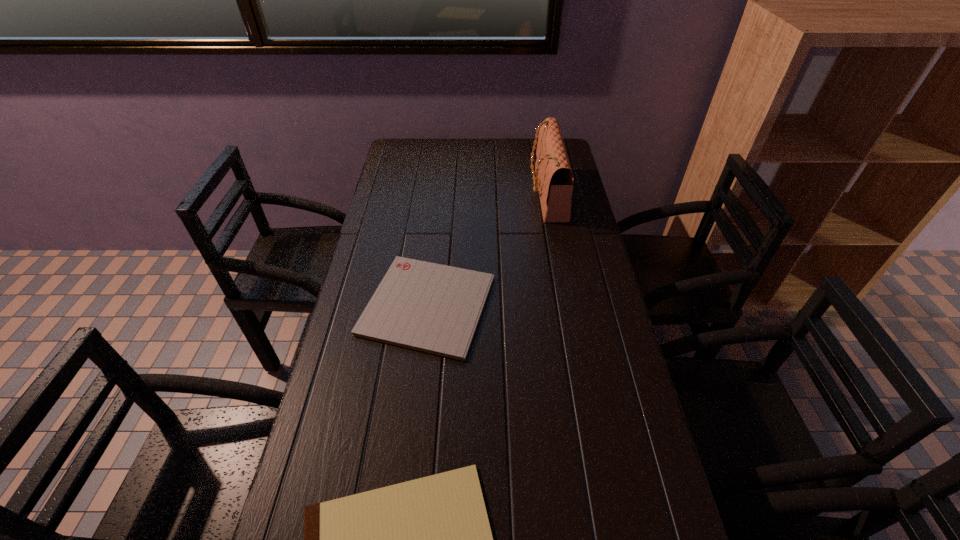
Where is `the farthest object`? Image resolution: width=960 pixels, height=540 pixels. the farthest object is located at coordinates (554, 179).

This screenshot has height=540, width=960. I want to click on handbag, so click(x=554, y=179).

Identify the location of the second shortest object. The height and width of the screenshot is (540, 960). (433, 308).

At what (x,y) coordinates should I click in order to perform the action: click on the second farthest object. Please return your answer as a coordinate pair (x, y). The image size is (960, 540). Looking at the image, I should click on (433, 308).

Identify the location of vacant space positioned on the front-facing side of the handbag. This screenshot has height=540, width=960. click(x=445, y=194).

Identify the location of vacant area situated 0.280m on the front-facing side of the handbag. (454, 194).

Where is `vacant space situated on the front-facing side of the handbag`? The width and height of the screenshot is (960, 540). vacant space situated on the front-facing side of the handbag is located at coordinates (484, 194).

At what (x,y) coordinates should I click in order to perform the action: click on vacant space located 0.050m on the back of the taller clipboard. Please return your answer as a coordinate pair (x, y). The height and width of the screenshot is (540, 960). Looking at the image, I should click on (434, 249).

In order to click on object positioned at the left edge in this screenshot , I will do `click(433, 308)`.

In order to click on object that is at the right edge in this screenshot , I will do `click(554, 179)`.